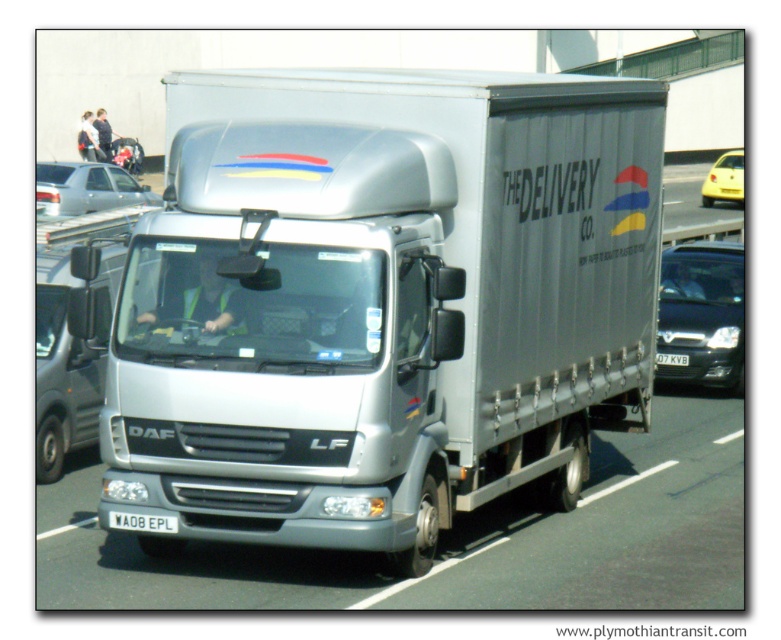
Which is in front, point (694, 237) or point (36, 198)?

Point (36, 198)

Can you confirm if yellow plastic car at right is smaller than silver metallic sedan at left?

Actually, yellow plastic car at right might be larger than silver metallic sedan at left.

Locate an element on the screen. The width and height of the screenshot is (781, 640). yellow plastic car at right is located at coordinates (701, 202).

Locate an element on the screen. This screenshot has height=640, width=781. yellow plastic car at right is located at coordinates (701, 202).

Does black glossy car at right appear on the left side of white plastic license plate at center?

In fact, black glossy car at right is to the right of white plastic license plate at center.

This screenshot has height=640, width=781. What do you see at coordinates (701, 314) in the screenshot? I see `black glossy car at right` at bounding box center [701, 314].

Between point (673, 333) and point (116, 512), which one is positioned behind?

Positioned behind is point (673, 333).

Locate an element on the screen. Image resolution: width=781 pixels, height=640 pixels. black glossy car at right is located at coordinates 701,314.

Does yellow matte taxi at right appear on the right side of white plastic license plate at center?

Indeed, yellow matte taxi at right is positioned on the right side of white plastic license plate at center.

Can you confirm if yellow matte taxi at right is smaller than white plastic license plate at center?

Incorrect, yellow matte taxi at right is not smaller in size than white plastic license plate at center.

Who is more distant from viewer, [733,189] or [155,518]?

The point [733,189] is more distant.

Image resolution: width=781 pixels, height=640 pixels. In order to click on yellow matte taxi at right in this screenshot , I will do `click(724, 179)`.